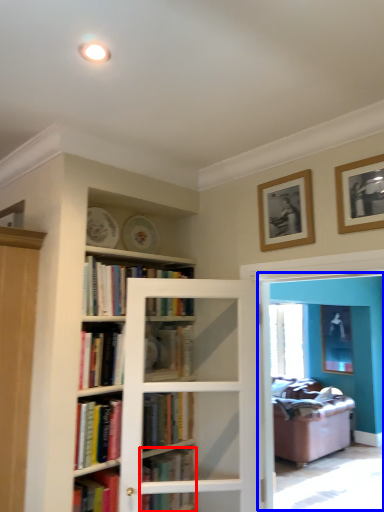
Question: Among these objects, which one is farthest to the camera, book (highlighted by a red box) or screen door (highlighted by a blue box)?

Choices:
 (A) book
 (B) screen door

Answer: (A)